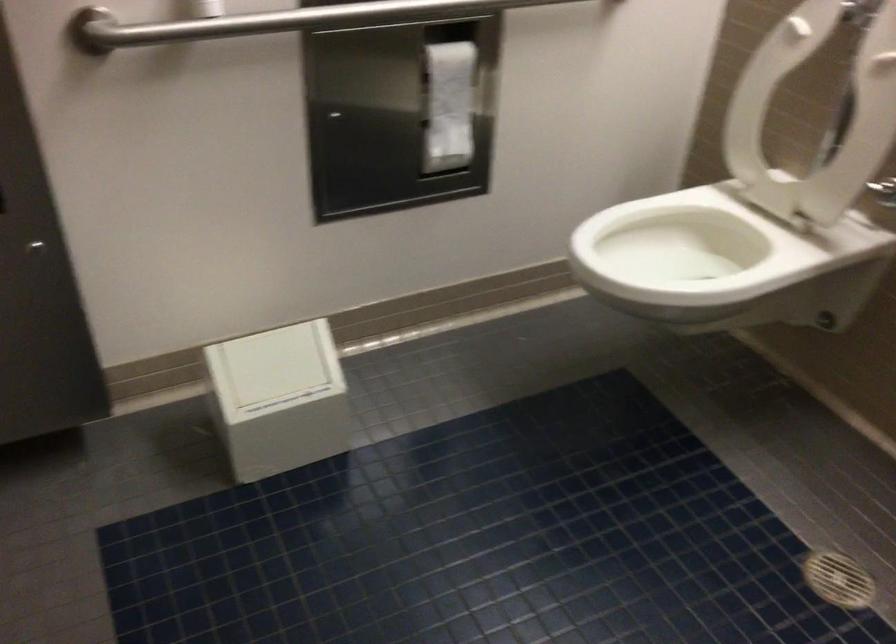
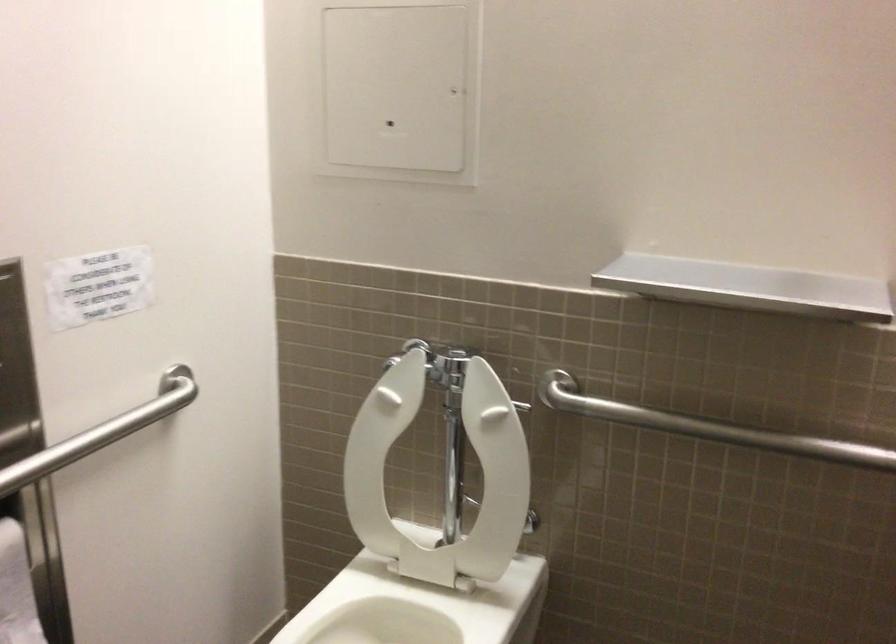
Question: The camera is either moving clockwise (left) or counter-clockwise (right) around the object. The first image is from the beginning of the video and the second image is from the end. Is the camera moving left or right when shooting the video?

Choices:
 (A) Left
 (B) Right

Answer: (A)